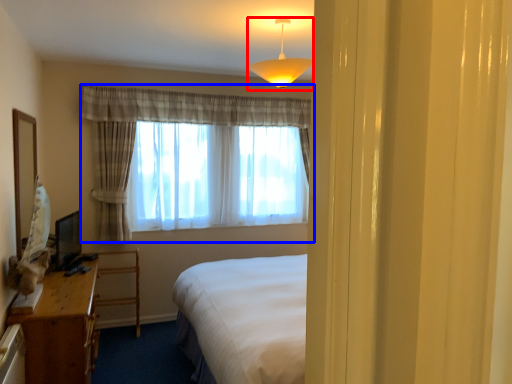
Question: Which of the following is the farthest to the observer, lamp (highlighted by a red box) or curtain (highlighted by a blue box)?

Choices:
 (A) lamp
 (B) curtain

Answer: (B)